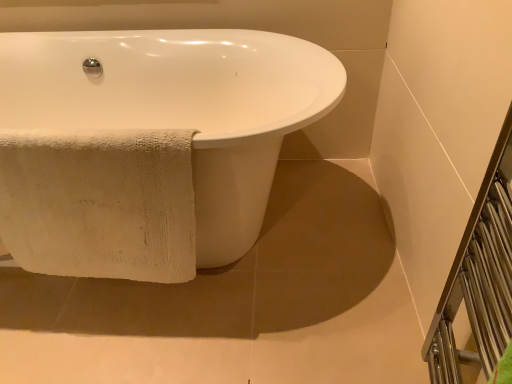
Question: Is beige cotton towel at lower left bigger than white towel at lower left?

Choices:
 (A) yes
 (B) no

Answer: (B)

Question: Can you confirm if beige cotton towel at lower left is positioned to the right of white towel at lower left?

Choices:
 (A) no
 (B) yes

Answer: (A)

Question: Is beige cotton towel at lower left at the left side of white towel at lower left?

Choices:
 (A) no
 (B) yes

Answer: (B)

Question: Would you say beige cotton towel at lower left is outside white towel at lower left?

Choices:
 (A) yes
 (B) no

Answer: (A)

Question: Is beige cotton towel at lower left facing away from white towel at lower left?

Choices:
 (A) yes
 (B) no

Answer: (B)

Question: Is beige cotton towel at lower left shorter than white towel at lower left?

Choices:
 (A) no
 (B) yes

Answer: (A)

Question: Is white towel at lower left surrounded by white glossy bathtub at center?

Choices:
 (A) no
 (B) yes

Answer: (A)

Question: From a real-world perspective, is white glossy bathtub at center located beneath white towel at lower left?

Choices:
 (A) yes
 (B) no

Answer: (B)

Question: Is white glossy bathtub at center thinner than white towel at lower left?

Choices:
 (A) no
 (B) yes

Answer: (B)

Question: Would you consider white glossy bathtub at center to be distant from white towel at lower left?

Choices:
 (A) yes
 (B) no

Answer: (B)

Question: Considering the relative sizes of white glossy bathtub at center and white towel at lower left in the image provided, is white glossy bathtub at center shorter than white towel at lower left?

Choices:
 (A) no
 (B) yes

Answer: (A)

Question: From a real-world perspective, is white glossy bathtub at center on top of white towel at lower left?

Choices:
 (A) yes
 (B) no

Answer: (A)

Question: Could you tell me if white glossy bathtub at center is turned towards beige cotton towel at lower left?

Choices:
 (A) yes
 (B) no

Answer: (A)